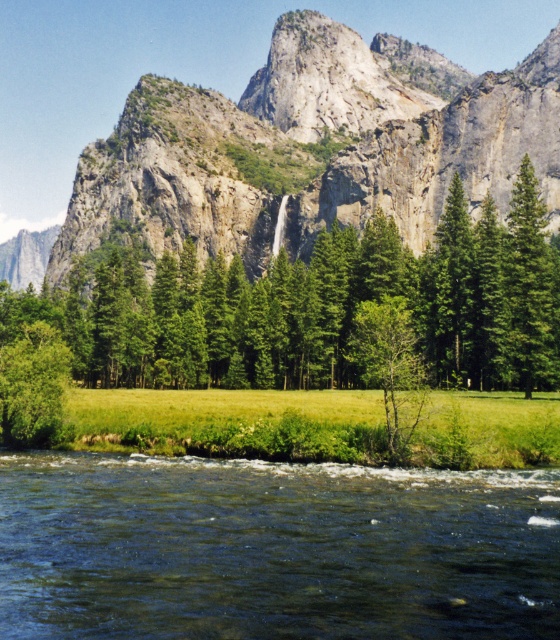
Locate an element on the screen. Image resolution: width=560 pixels, height=640 pixels. dark green water at lower center is located at coordinates (272, 548).

Between point (324, 512) and point (412, 330), which one is positioned behind?

Point (412, 330)

Identify the location of dark green water at lower center. This screenshot has height=640, width=560. pos(272,548).